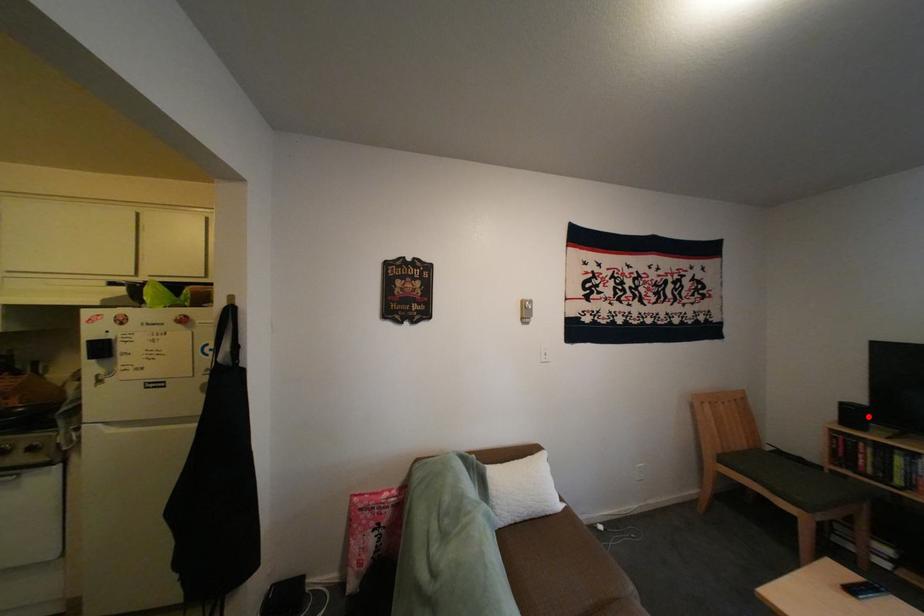
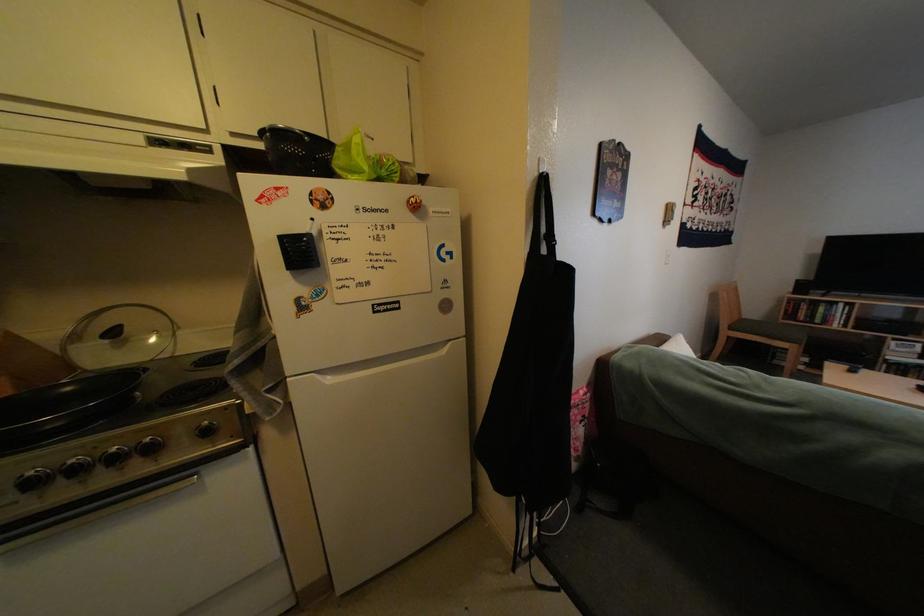
The point at the highlighted location is marked in the first image. Where is the corresponding point in the second image?

(816, 288)